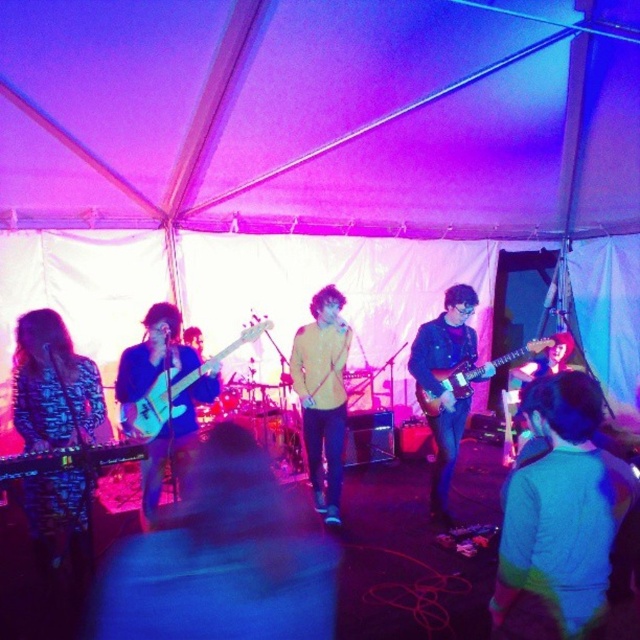
Can you confirm if matte white electric guitar at left is positioned below matte black guitar at center?

Incorrect, matte white electric guitar at left is not positioned below matte black guitar at center.

Who is lower down, matte white electric guitar at left or matte black guitar at center?

matte black guitar at center is below.

The height and width of the screenshot is (640, 640). I want to click on matte white electric guitar at left, so click(173, 390).

Identify the location of matte white electric guitar at left. The height and width of the screenshot is (640, 640). (173, 390).

Can you confirm if yellow matte jacket at center is positioned to the right of denim jacket at center?

In fact, yellow matte jacket at center is to the left of denim jacket at center.

At what (x,y) coordinates should I click in order to perform the action: click on yellow matte jacket at center. Please return your answer as a coordinate pair (x, y). The width and height of the screenshot is (640, 640). Looking at the image, I should click on click(323, 396).

Find the location of a particular element. Image resolution: width=640 pixels, height=640 pixels. yellow matte jacket at center is located at coordinates (323, 396).

Does printed fabric dress at left have a lesser height compared to glossy electric guitar at center?

In fact, printed fabric dress at left may be taller than glossy electric guitar at center.

Is printed fabric dress at left to the left of glossy electric guitar at center from the viewer's perspective?

→ Indeed, printed fabric dress at left is positioned on the left side of glossy electric guitar at center.

Is point (61, 536) positioned behind point (492, 365)?

No.

Locate an element on the screen. This screenshot has height=640, width=640. printed fabric dress at left is located at coordinates (52, 385).